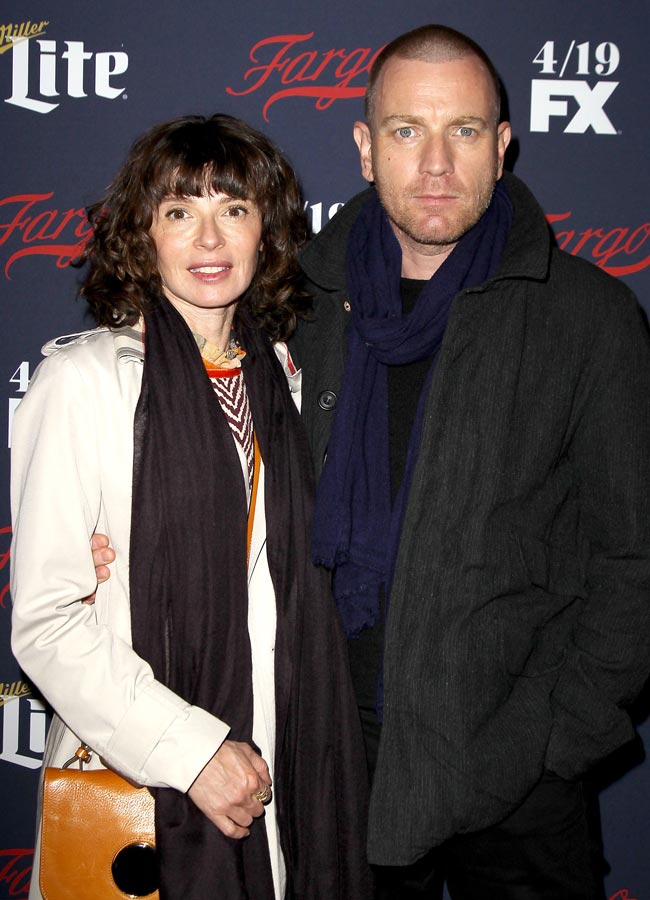
Locate an element on the screen. leather is located at coordinates (103, 840).